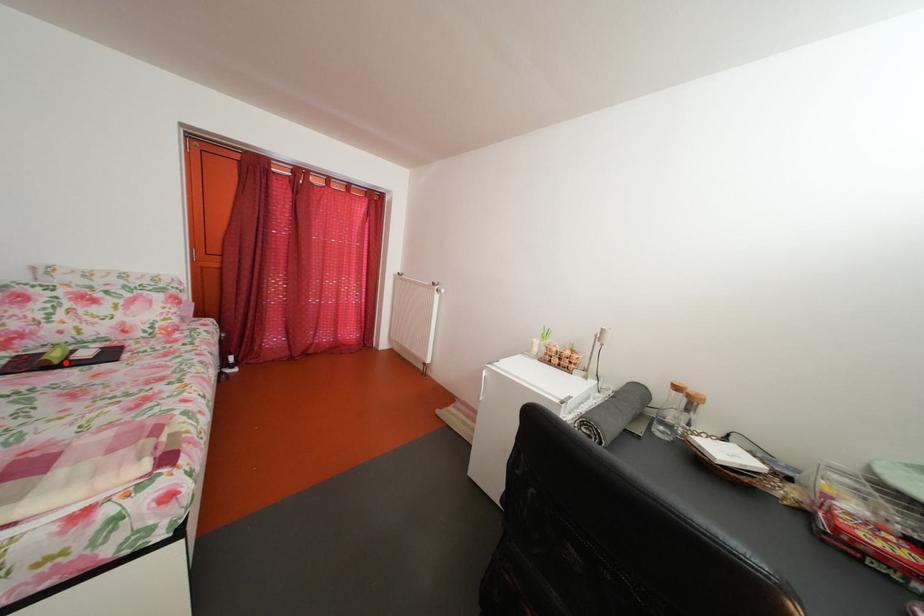
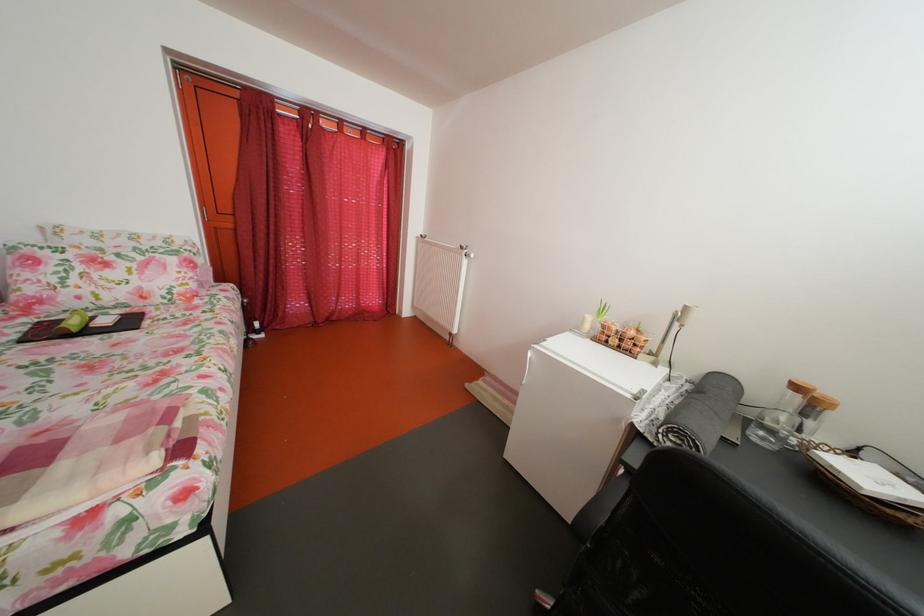
Question: I am providing you with two images of the same scene from different viewpoints. A red point is marked on the first image. Is the red point's position out of view in image 2?

Choices:
 (A) Yes
 (B) No

Answer: (B)